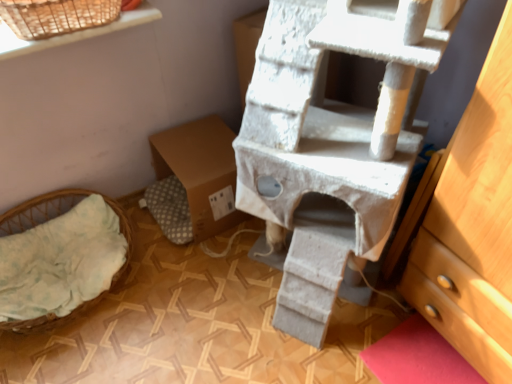
Measure the distance between point (201, 128) and camera.

The depth of point (201, 128) is 1.81 meters.

Describe the element at coordinates (199, 172) in the screenshot. This screenshot has width=512, height=384. I see `brown cardboard box at center` at that location.

This screenshot has height=384, width=512. Describe the element at coordinates (40, 209) in the screenshot. I see `light green fabric basket at lower left` at that location.

Where is `white textured cat tree at center`? This screenshot has height=384, width=512. white textured cat tree at center is located at coordinates (330, 143).

Is brown cardboard box at center completely or partially inside light green fabric basket at lower left?

Actually, brown cardboard box at center is outside light green fabric basket at lower left.

In the scene shown: Which of these two, light green fabric basket at lower left or brown cardboard box at center, is wider?

light green fabric basket at lower left.

Does point (27, 211) appear closer or farther from the camera than point (185, 203)?

Point (27, 211) is positioned closer to the camera compared to point (185, 203).

Is light green fabric basket at lower left positioned with its back to brown cardboard box at center?

No, brown cardboard box at center is not at the back of light green fabric basket at lower left.

In the image, is brown cardboard box at center on the left side or the right side of white textured cat tree at center?

Based on their positions, brown cardboard box at center is located to the left of white textured cat tree at center.

How different are the orientations of brown cardboard box at center and white textured cat tree at center in degrees?

They differ by 59 degrees in their facing directions.

Considering the sizes of objects brown cardboard box at center and white textured cat tree at center in the image provided, who is shorter, brown cardboard box at center or white textured cat tree at center?

brown cardboard box at center.

Can you confirm if light green fabric basket at lower left is wider than white textured cat tree at center?

No, light green fabric basket at lower left is not wider than white textured cat tree at center.

From the image's perspective, is light green fabric basket at lower left above white textured cat tree at center?

No, from the image's perspective, light green fabric basket at lower left is not above white textured cat tree at center.

Which is behind, light green fabric basket at lower left or white textured cat tree at center?

light green fabric basket at lower left.

Is light green fabric basket at lower left placed right next to white textured cat tree at center?

light green fabric basket at lower left and white textured cat tree at center are clearly separated.

From a real-world perspective, who is located higher, white textured cat tree at center or light green fabric basket at lower left?

In real-world perspective, white textured cat tree at center is above.

Which is more to the left, white textured cat tree at center or light green fabric basket at lower left?

light green fabric basket at lower left is more to the left.

You are a GUI agent. You are given a task and a screenshot of the screen. Output one action in this format:
    pyautogui.click(x=<x>, y=<y>)
    Task: Click on the furniture below the white textured cat tree at center (from a real-world perspective)
    The width and height of the screenshot is (512, 384).
    Given the screenshot: What is the action you would take?
    pyautogui.click(x=40, y=209)

In the scene shown: From the image's perspective, relative to light green fabric basket at lower left, is white textured cat tree at center above or below?

white textured cat tree at center is situated higher than light green fabric basket at lower left in the image.

Which object is thinner, white textured cat tree at center or brown cardboard box at center?

Thinner between the two is brown cardboard box at center.

Considering the positions of objects white textured cat tree at center and brown cardboard box at center in the image provided, who is more to the right, white textured cat tree at center or brown cardboard box at center?

From the viewer's perspective, white textured cat tree at center appears more on the right side.

Locate an element on the screen. The height and width of the screenshot is (384, 512). cardboard box directly beneath the white textured cat tree at center (from a real-world perspective) is located at coordinates (199, 172).

Between white textured cat tree at center and brown cardboard box at center, which one is positioned behind?

Positioned behind is brown cardboard box at center.

Is light green fabric basket at lower left surrounded by brown cardboard box at center?

No.

How different are the orientations of brown cardboard box at center and light green fabric basket at lower left in degrees?

0.000142 degrees.

Considering the positions of point (216, 158) and point (32, 199), is point (216, 158) closer or farther from the camera than point (32, 199)?

Point (216, 158) is closer to the camera than point (32, 199).

Are brown cardboard box at center and light green fabric basket at lower left making contact?

brown cardboard box at center is not next to light green fabric basket at lower left, and they're not touching.

This screenshot has width=512, height=384. What are the coordinates of `furniture in front of the brown cardboard box at center` in the screenshot? It's located at (x=40, y=209).

This screenshot has width=512, height=384. I want to click on bunk bed on the right of brown cardboard box at center, so click(x=330, y=143).

From the image, which object appears to be farther from white textured cat tree at center, light green fabric basket at lower left or brown cardboard box at center?

light green fabric basket at lower left is positioned further to the anchor white textured cat tree at center.

From the picture: From the image, which object appears to be farther from light green fabric basket at lower left, brown cardboard box at center or white textured cat tree at center?

The object further to light green fabric basket at lower left is white textured cat tree at center.

When comparing their distances from light green fabric basket at lower left, does white textured cat tree at center or brown cardboard box at center seem closer?

brown cardboard box at center.

Which object lies further to the anchor point brown cardboard box at center, light green fabric basket at lower left or white textured cat tree at center?

white textured cat tree at center lies further to brown cardboard box at center than the other object.

Estimate the real-world distances between objects in this image. Which object is further from white textured cat tree at center, brown cardboard box at center or light green fabric basket at lower left?

Based on the image, light green fabric basket at lower left appears to be further to white textured cat tree at center.

Based on their spatial positions, is white textured cat tree at center or light green fabric basket at lower left further from brown cardboard box at center?

The object further to brown cardboard box at center is white textured cat tree at center.

Locate an element on the screen. The width and height of the screenshot is (512, 384). cardboard box between light green fabric basket at lower left and white textured cat tree at center from left to right is located at coordinates (199, 172).